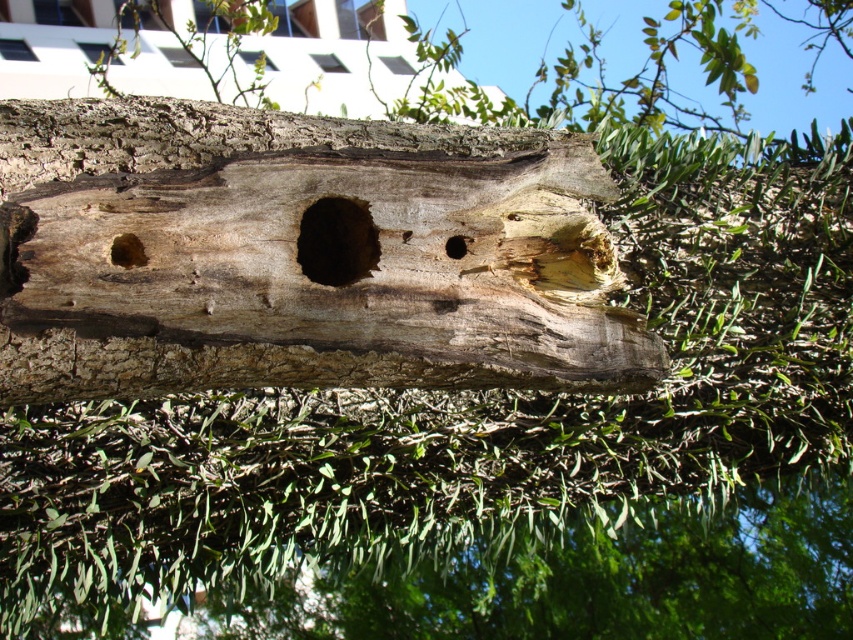
You are a biologist examining a tree trunk with two holes. You have a measuring tape and need to determine which hole is wider. You see the brown rough hole at center and the smooth brown hole at center. Which one is wider?

The brown rough hole at center is wider than the smooth brown hole at center according to the description.

Looking at this image, you are a nature photographer aiming to capture the weathered wood log at center and the brown rough hole at left in a single frame. Based on their sizes, which object should you focus on to ensure both are clearly visible without needing to zoom in or out?

The weathered wood log at center is much taller than the brown rough hole at left, so focusing on the weathered wood log at center will ensure both objects are visible without adjusting the zoom.

You are standing in front of a tree trunk with rough bark and two holes. There is a point marked at coordinates point (415, 323). Can you estimate how far this point is from your current position?

The point (415, 323) is 2.18 meters away from the camera, so it is approximately 2.18 meters away from your current position.